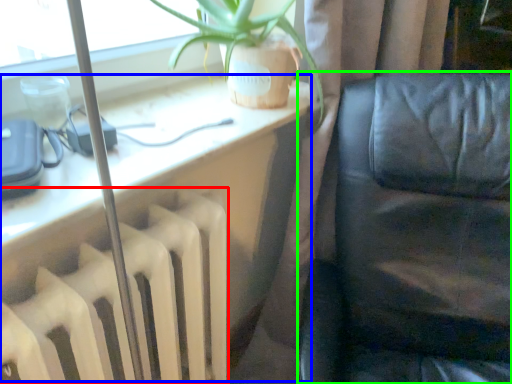
Question: Considering the real-world distances, which object is closest to radiator (highlighted by a red box)? computer desk (highlighted by a blue box) or furniture (highlighted by a green box).

Choices:
 (A) computer desk
 (B) furniture

Answer: (A)